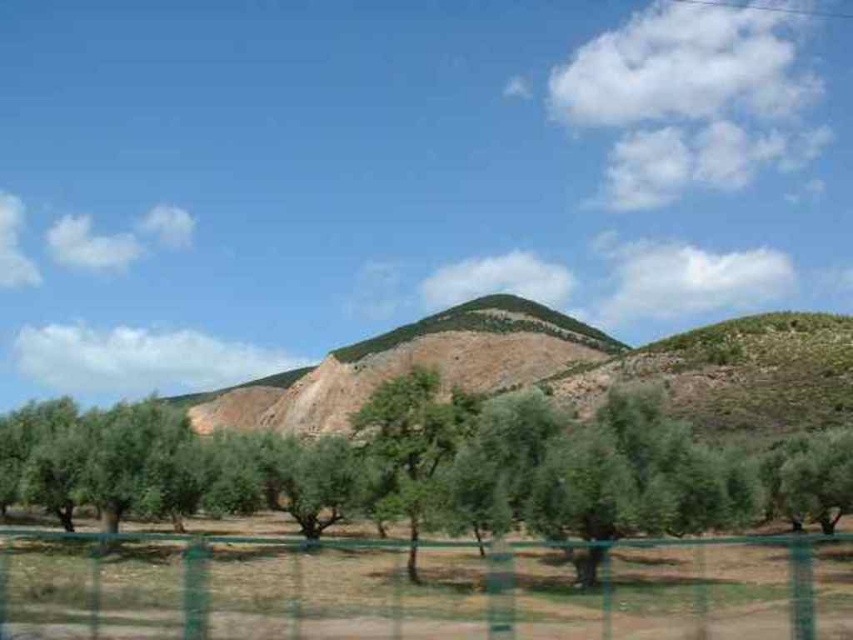
You are standing in the middle of the olive grove and want to walk towards the green wire mesh fence at lower center. Which direction should you walk relative to the green leafy tree at center?

You should walk to the right relative to the green leafy tree at center because the green wire mesh fence at lower center is positioned to the right of the tree.

You are standing in the rural landscape and want to take a photo of the green leafy tree at center without the green wire mesh fence at lower center blocking the view. Is the tree taller than the fence?

The green leafy tree at center has a greater height compared to the green wire mesh fence at lower center, so yes, the tree is taller than the fence and won